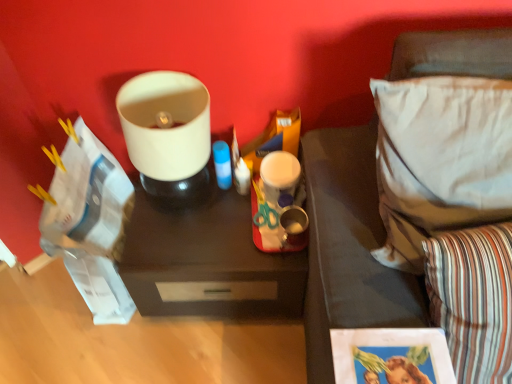
Question: Considering their positions, is white fabric pillow at right, the first pillow viewed from the top, located in front of or behind matte white lampshade at upper center?

Choices:
 (A) behind
 (B) front

Answer: (B)

Question: Which is correct: white fabric pillow at right, the 2th pillow in the bottom-to-top sequence, is inside matte white lampshade at upper center, or outside of it?

Choices:
 (A) inside
 (B) outside

Answer: (B)

Question: Which of these objects is positioned closest to the white fabric pillow at right, the first pillow viewed from the top?

Choices:
 (A) dark wood tray at center
 (B) striped fabric pillow at lower right, arranged as the 1th pillow when ordered from the bottom
 (C) matte white lampshade at upper center

Answer: (B)

Question: Considering the real-world distances, which object is farthest from the striped fabric pillow at lower right, the second pillow in the top-to-bottom sequence?

Choices:
 (A) white fabric pillow at right, the first pillow viewed from the top
 (B) matte white lampshade at upper center
 (C) dark wood tray at center

Answer: (B)